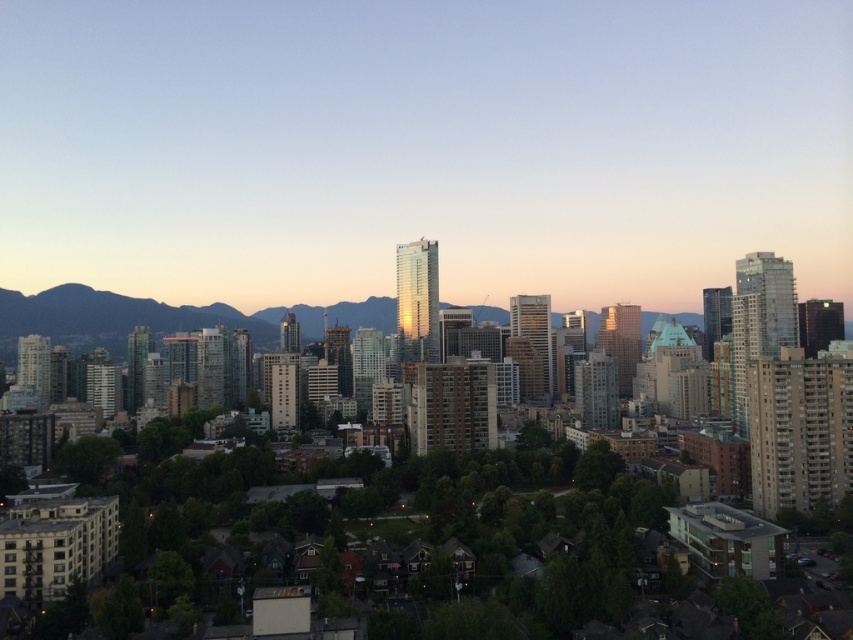
Question: In this image, where is matte glass skyscraper at center located relative to rocky brown mountain at center?

Choices:
 (A) left
 (B) right

Answer: (B)

Question: From the image, what is the correct spatial relationship of matte glass skyscraper at center in relation to rocky brown mountain at center?

Choices:
 (A) left
 (B) right

Answer: (B)

Question: Among these points, which one is farthest from the camera?

Choices:
 (A) (56, 300)
 (B) (184, 58)

Answer: (B)

Question: Among these objects, which one is farthest from the camera?

Choices:
 (A) rocky brown mountain at center
 (B) matte glass skyscraper at center

Answer: (A)

Question: Observing the image, what is the correct spatial positioning of matte glass skyscraper at center in reference to rocky brown mountain at center?

Choices:
 (A) above
 (B) below

Answer: (A)